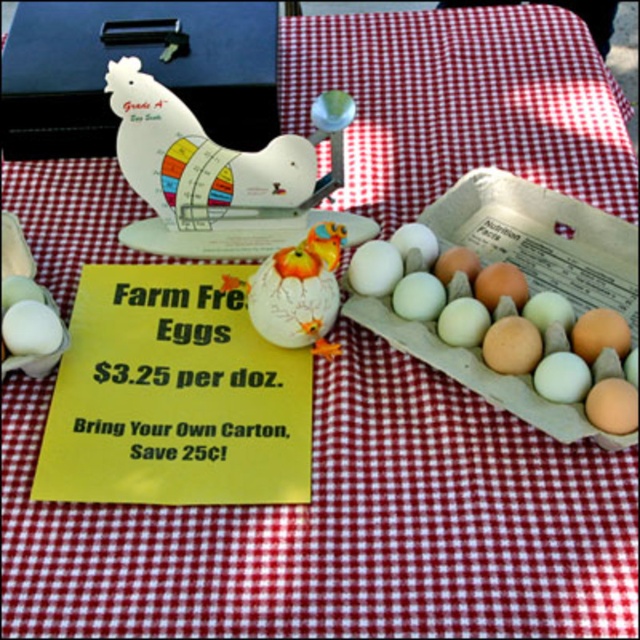
Question: Which of these objects is positioned farthest from the wooden at upper center?

Choices:
 (A) matte plastic chicken at center
 (B) white matte egg at lower left
 (C) white matte egg at center
 (D) matte brown egg at center

Answer: (B)

Question: Does matte brown egg at center have a greater width compared to white matte egg at lower left?

Choices:
 (A) no
 (B) yes

Answer: (B)

Question: Which of the following is the farthest from the observer?

Choices:
 (A) matte plastic chicken at center
 (B) wooden at upper center
 (C) white matte egg at lower left

Answer: (B)

Question: Considering the relative positions of wooden at upper center and matte brown egg at center in the image provided, where is wooden at upper center located with respect to matte brown egg at center?

Choices:
 (A) right
 (B) left

Answer: (B)

Question: Which of the following is the closest to the observer?

Choices:
 (A) matte brown egg at center
 (B) white matte egg at lower left
 (C) white matte egg at center

Answer: (A)

Question: Does wooden at upper center lie behind matte brown egg at center?

Choices:
 (A) no
 (B) yes

Answer: (B)